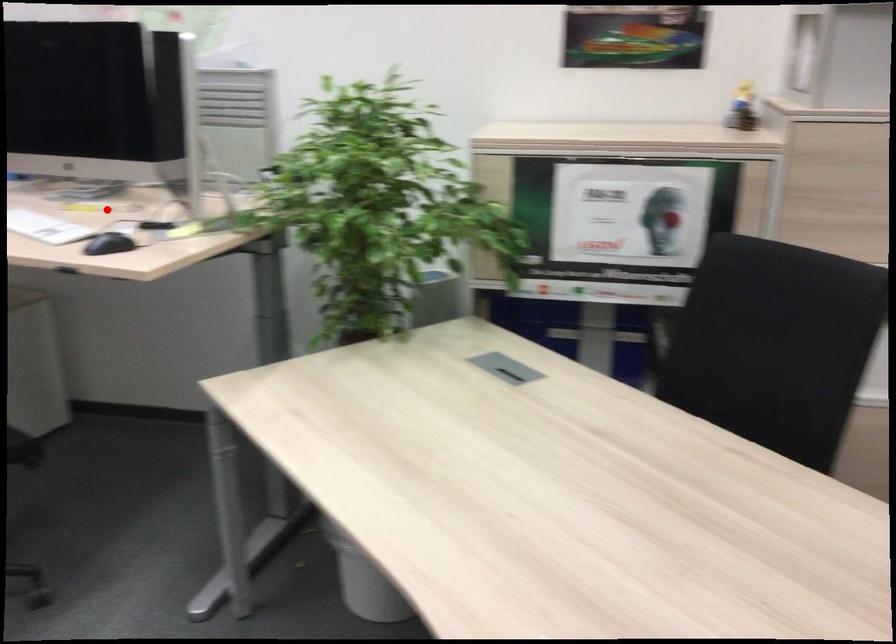
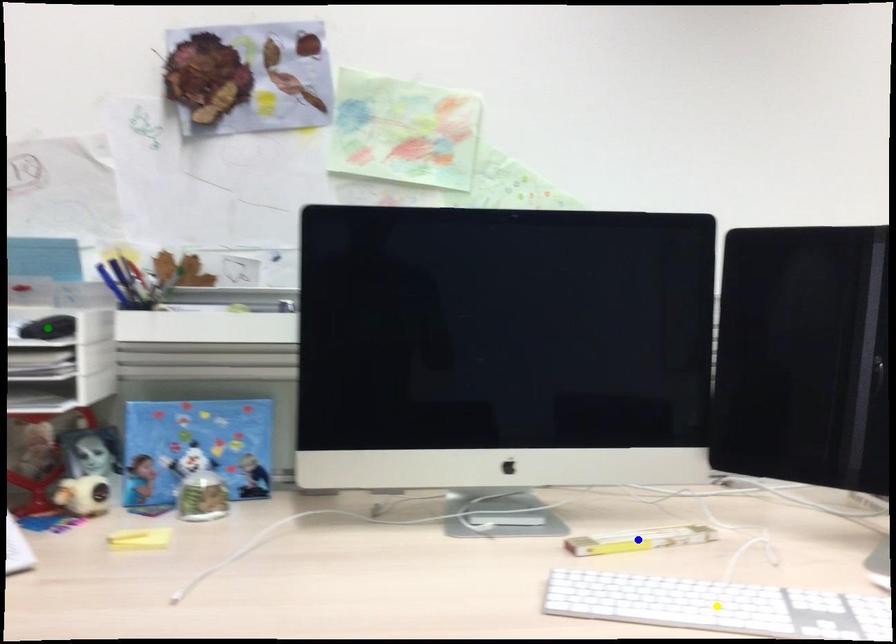
Question: I am providing you with two images of the same scene from different viewpoints. A red point is marked on the first image. You are given multiple points on the second image. Which mark in image 2 goes with the point in image 1?

Choices:
 (A) yellow point
 (B) blue point
 (C) green point

Answer: (B)